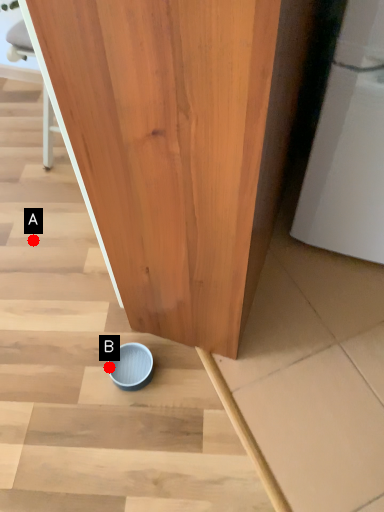
Question: Two points are circled on the image, labeled by A and B beside each circle. Which point is closer to the camera?

Choices:
 (A) A is closer
 (B) B is closer

Answer: (B)